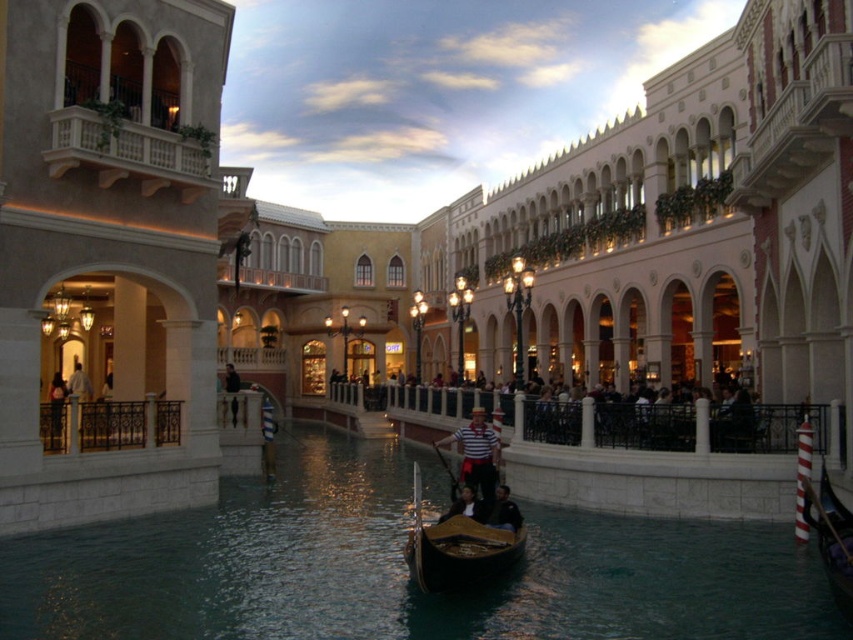
Describe the element at coordinates (457, 545) in the screenshot. The width and height of the screenshot is (853, 640). I see `gold polished wood boat at center` at that location.

Between point (442, 541) and point (466, 497), which one is positioned in front?

Point (442, 541) is in front.

Is point (456, 573) closer to camera compared to point (439, 518)?

Yes, point (456, 573) is closer to viewer.

You are a GUI agent. You are given a task and a screenshot of the screen. Output one action in this format:
    pyautogui.click(x=<x>, y=<y>)
    Task: Click on the gold polished wood boat at center
    The height and width of the screenshot is (640, 853).
    Given the screenshot: What is the action you would take?
    pyautogui.click(x=457, y=545)

Is smooth stone balcony at upper left shorter than dark brown leather jacket at lower center?

In fact, smooth stone balcony at upper left may be taller than dark brown leather jacket at lower center.

Which is more to the left, smooth stone balcony at upper left or dark brown leather jacket at lower center?

From the viewer's perspective, smooth stone balcony at upper left appears more on the left side.

Find the location of a particular element. Image resolution: width=853 pixels, height=640 pixels. smooth stone balcony at upper left is located at coordinates (109, 237).

Can you confirm if shiny dark wood gondola at center is thinner than dark brown leather jacket at lower center?

Incorrect, shiny dark wood gondola at center's width is not less than dark brown leather jacket at lower center's.

Does shiny dark wood gondola at center appear under dark brown leather jacket at lower center?

Correct, shiny dark wood gondola at center is located below dark brown leather jacket at lower center.

In order to click on shiny dark wood gondola at center in this screenshot , I will do `click(399, 566)`.

Locate an element on the screen. The image size is (853, 640). shiny dark wood gondola at center is located at coordinates (399, 566).